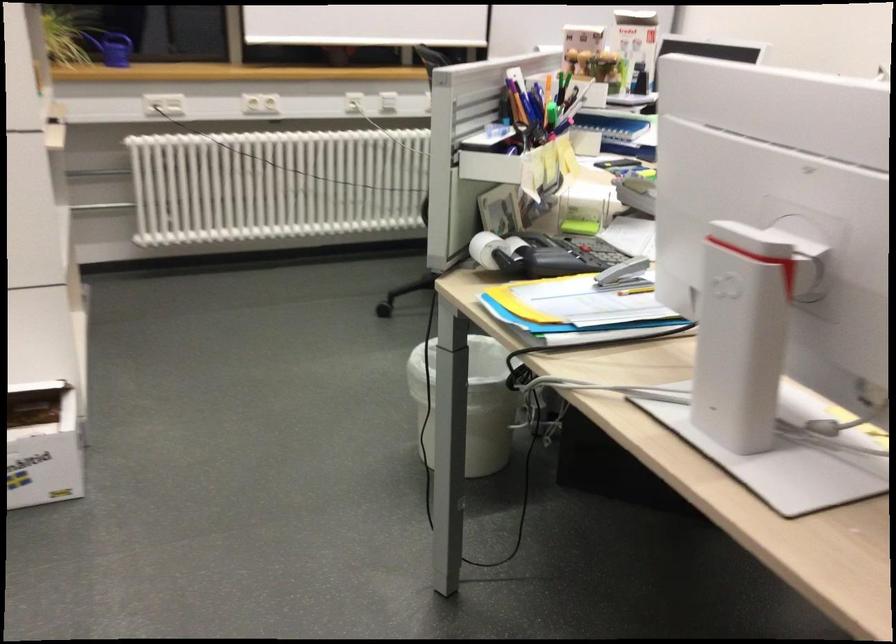
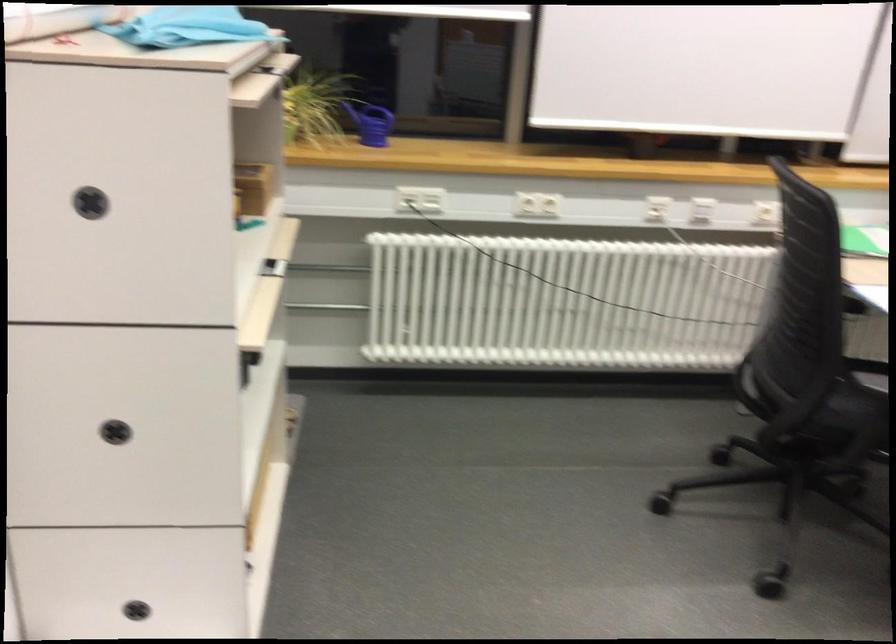
Which direction would the cameraman need to move to produce the second image?

The movement direction of the cameraman is left, forward.